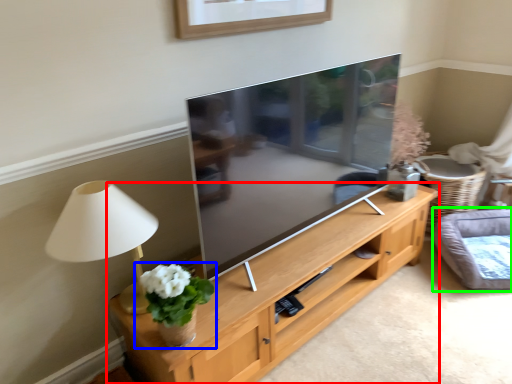
Question: Considering the real-world distances, which object is farthest from shelf (highlighted by a red box)? houseplant (highlighted by a blue box) or cat bed (highlighted by a green box)?

Choices:
 (A) houseplant
 (B) cat bed

Answer: (B)